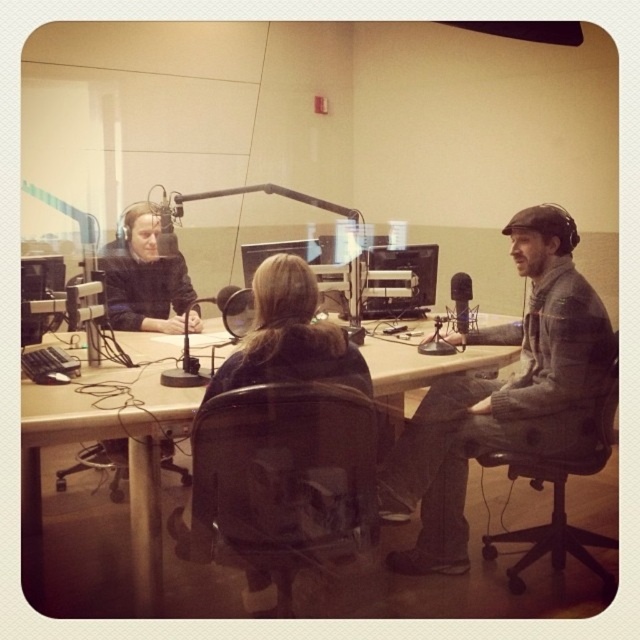
You are a guest in the radio studio and need to adjust your headphones and microphone. Based on the scene, where should you look to find the matte black headphones at left and the matte black microphone at center?

The matte black headphones at left are located to the left of the matte black microphone at center.

You are a technician in the radio studio and need to adjust the matte black headphones at left. Considering your arm reaches 3 feet, can you reach them without moving your chair?

The matte black headphones at left are 8.99 feet away from the viewer. Since your arm reaches 3 feet, you cannot reach them without moving your chair.

You are a guest speaker entering the radio studio and need to place your notes on the wooden table at center. However, there are matte black headphones at left on the table. Can you fit your notes between them without moving the headphones?

The wooden table at center and matte black headphones at left are 15.87 inches apart, so yes, there is enough space to place your notes between them without moving the headphones.